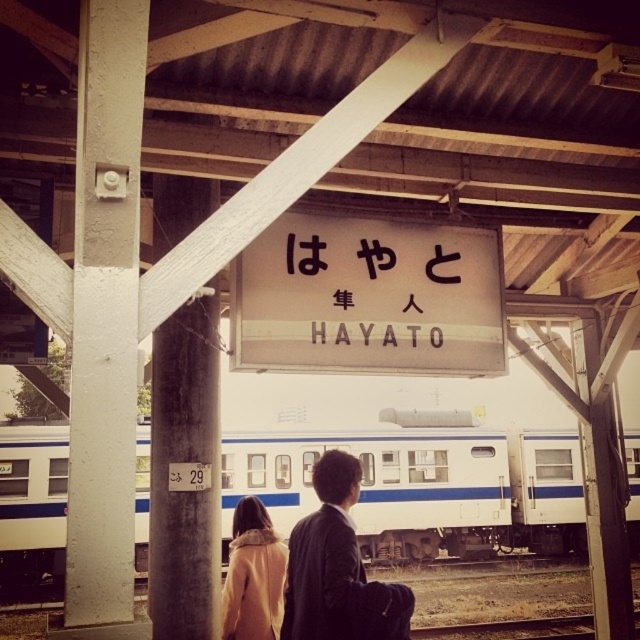
Consider the image. You are a photographer wanting to capture the entire white glossy train at center and white painted wood at left in a single frame. Based on the scene, which object should you position closer to the camera to ensure both fit in the frame?

Since the white glossy train at center is wider than the white painted wood at left, you should position the white painted wood at left closer to the camera to ensure both fit in the frame.